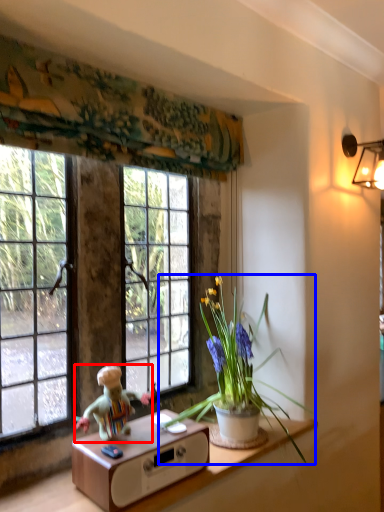
Question: Which point is further to the camera, person (highlighted by a red box) or houseplant (highlighted by a blue box)?

Choices:
 (A) person
 (B) houseplant

Answer: (A)